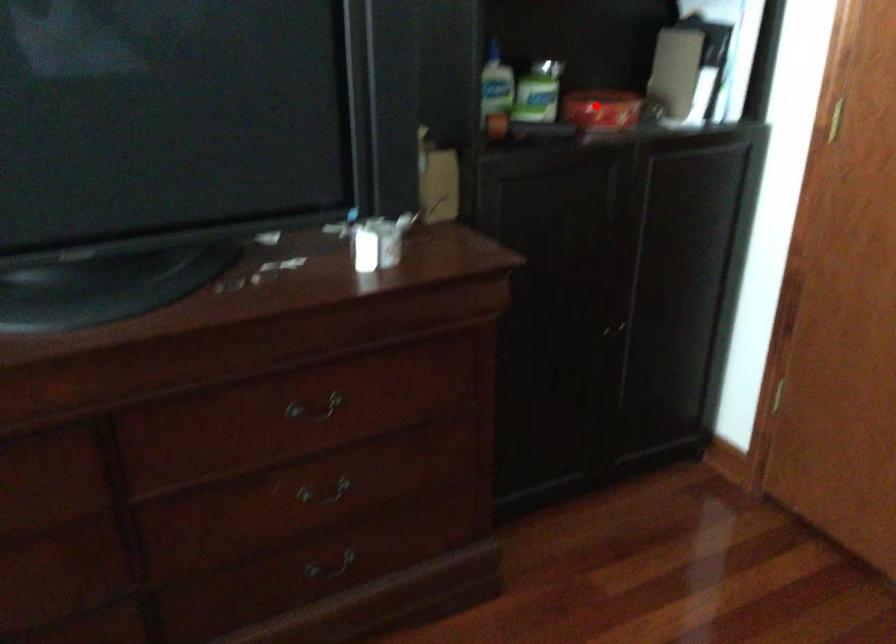
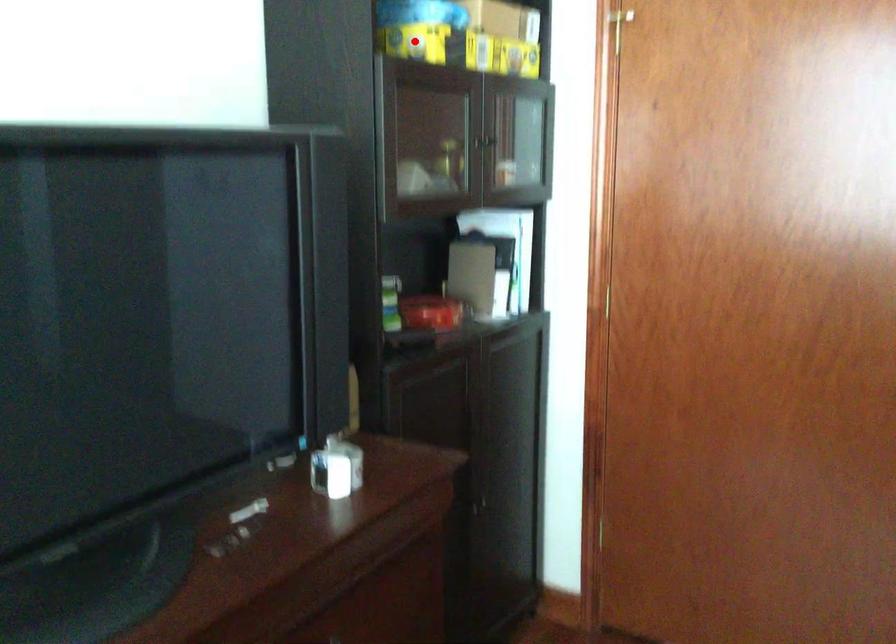
I am providing you with two images of the same scene from different viewpoints. A red point is marked on the first image and another point is marked on the second image. Does the point marked in image1 correspond to the same location as the one in image2?

No